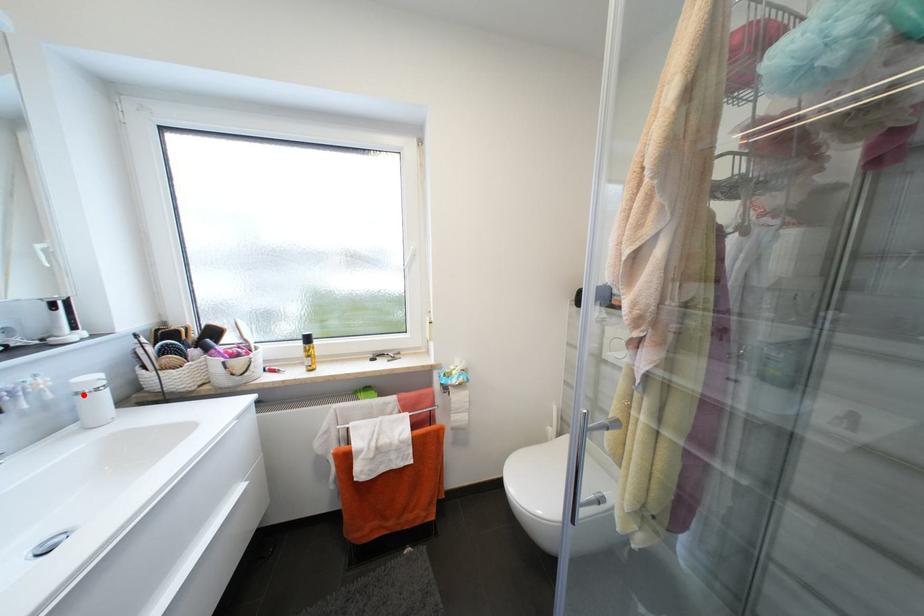
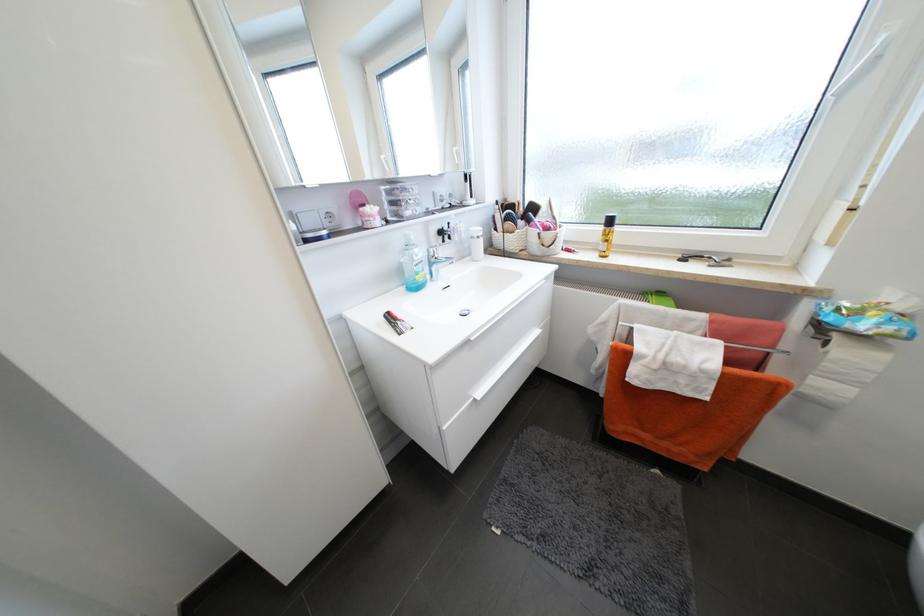
Question: I am providing you with two images of the same scene from different viewpoints. A red point is marked on the first image. Can you still see the location of the red point in image 2?

Choices:
 (A) Yes
 (B) No

Answer: (A)